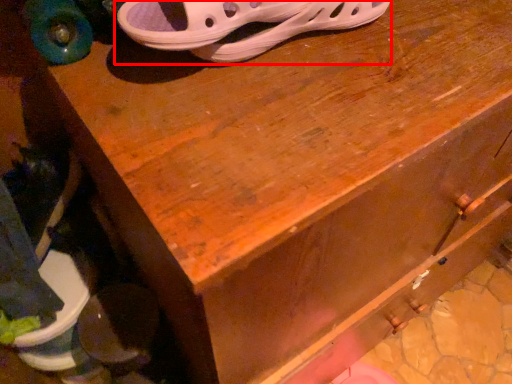
Question: From the image's perspective, what is the correct spatial positioning of footwear (annotated by the red box) in reference to footwear?

Choices:
 (A) above
 (B) below

Answer: (A)